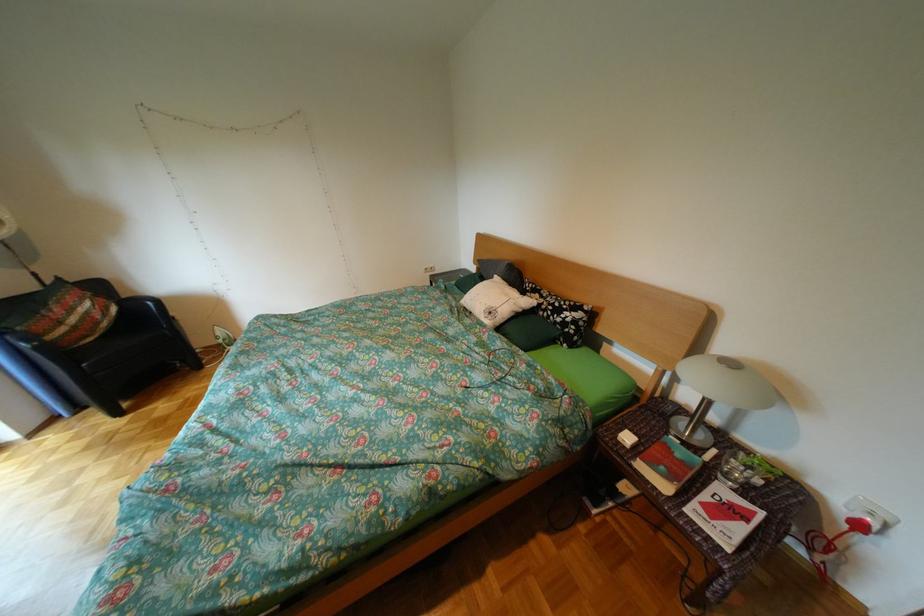
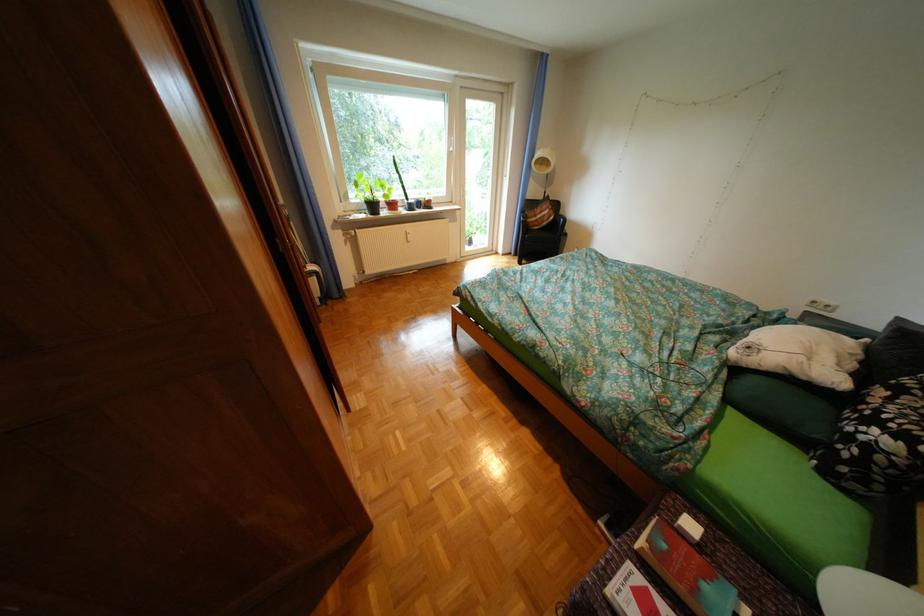
In the second image, find the point that corresponds to (505,314) in the first image.

(763, 349)